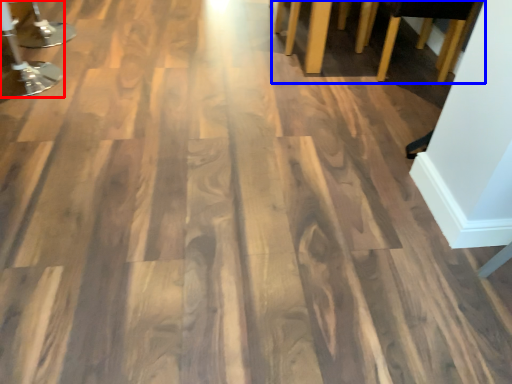
Question: Which object appears farthest to the camera in this image, furniture (highlighted by a red box) or furniture (highlighted by a blue box)?

Choices:
 (A) furniture
 (B) furniture

Answer: (B)